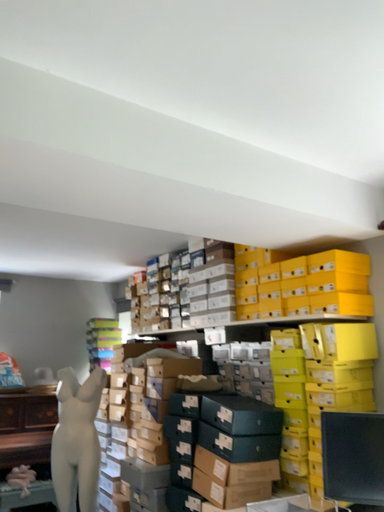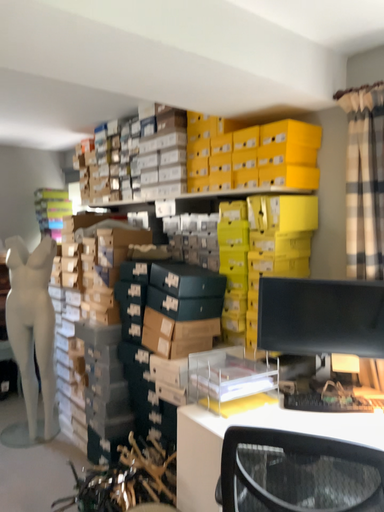
Question: Which way did the camera rotate in the video?

Choices:
 (A) rotated upward
 (B) rotated downward

Answer: (B)